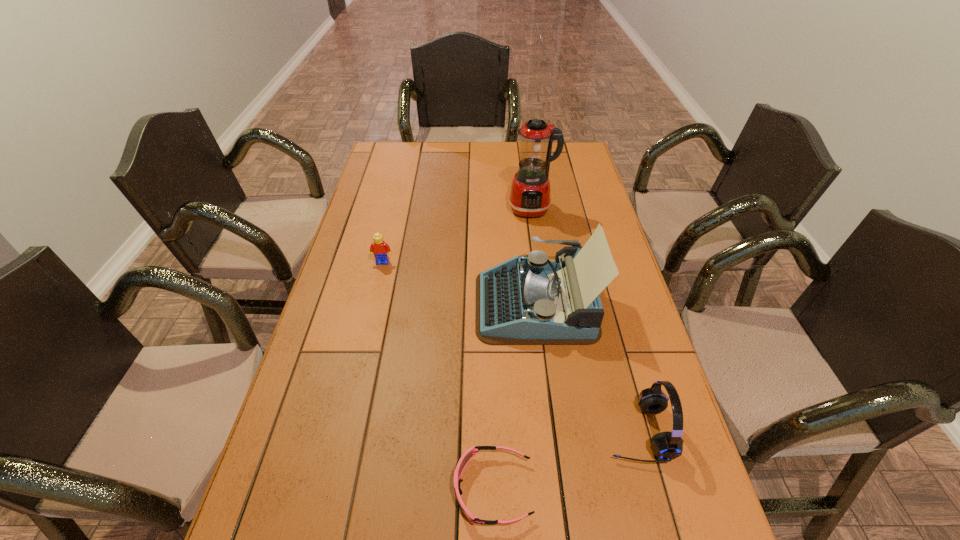
The height and width of the screenshot is (540, 960). I want to click on free spot located 0.390m on the typing side of the typewriter, so click(x=341, y=304).

Find the location of a particular element. The width and height of the screenshot is (960, 540). vacant area located 0.090m on the typing side of the typewriter is located at coordinates (444, 304).

I want to click on free space located on the ear cushions of the third shortest object, so click(x=459, y=431).

Locate an element on the screen. This screenshot has height=540, width=960. free space located on the ear cushions of the third shortest object is located at coordinates (445, 431).

Where is `blank space located 0.060m on the ear cushions of the third shortest object`? blank space located 0.060m on the ear cushions of the third shortest object is located at coordinates (578, 431).

The width and height of the screenshot is (960, 540). Find the location of `free space located on the front-facing side of the fourth nearest object`. free space located on the front-facing side of the fourth nearest object is located at coordinates (372, 308).

Where is `vacant space located on the front-facing side of the goggles`? This screenshot has height=540, width=960. vacant space located on the front-facing side of the goggles is located at coordinates click(x=386, y=489).

At what (x,y) coordinates should I click in order to perform the action: click on vacant space located 0.270m on the front-facing side of the goggles. Please return your answer as a coordinate pair (x, y). Looking at the image, I should click on (323, 489).

Identify the location of vacant space located on the front-facing side of the goggles. The height and width of the screenshot is (540, 960). (303, 489).

Find the location of a particular element. The image size is (960, 540). object located in the left edge section of the desktop is located at coordinates (380, 249).